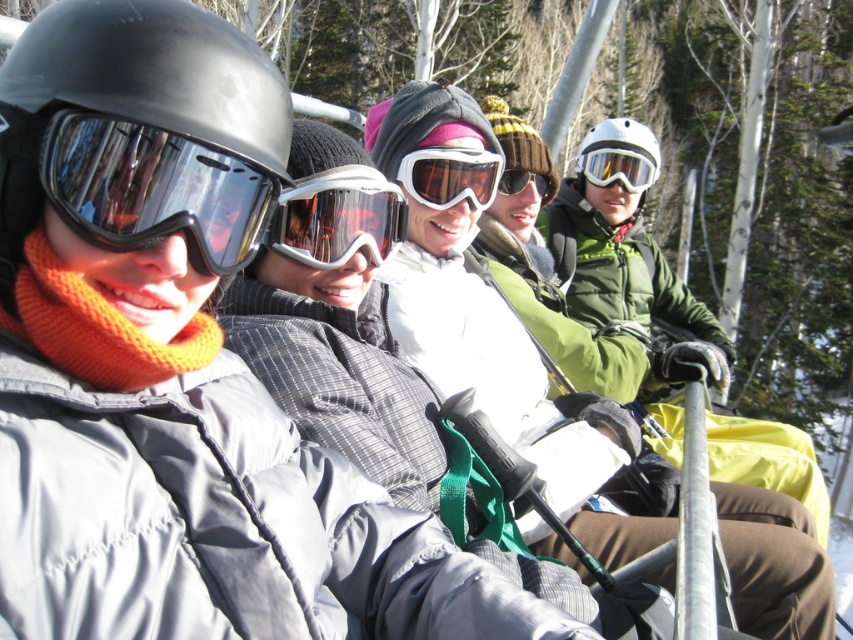
The image size is (853, 640). What do you see at coordinates (618, 168) in the screenshot? I see `white matte helmet at center` at bounding box center [618, 168].

Looking at this image, which is more to the left, white matte helmet at center or matte black goggles at center?

Positioned to the left is matte black goggles at center.

Identify the location of white matte helmet at center. (618, 168).

Locate an element on the screen. white matte helmet at center is located at coordinates coord(618,168).

Is white matte goggles at center bigger than matte black goggles at center?

Indeed, white matte goggles at center has a larger size compared to matte black goggles at center.

Is white matte goggles at center above matte black goggles at center?

Incorrect, white matte goggles at center is not positioned above matte black goggles at center.

Who is more distant from viewer, (474, 177) or (538, 186)?

The point (538, 186) is behind.

Locate an element on the screen. This screenshot has width=853, height=640. white matte goggles at center is located at coordinates (450, 177).

Can you confirm if matte black goggles at left is positioned to the right of white matte goggles at center?

Incorrect, matte black goggles at left is not on the right side of white matte goggles at center.

Which is below, matte black goggles at left or white matte goggles at center?

matte black goggles at left

Is point (54, 182) more distant than point (451, 172)?

That is False.

This screenshot has height=640, width=853. I want to click on matte black goggles at left, so click(x=154, y=189).